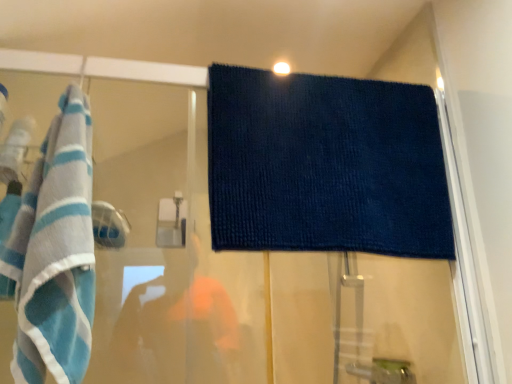
Question: Considering the positions of blue striped towel at left, arranged as the 1th towel when viewed from the front, and dark blue textured towel at upper center, which ranks as the second towel in front-to-back order, in the image, is blue striped towel at left, arranged as the 1th towel when viewed from the front, wider or thinner than dark blue textured towel at upper center, which ranks as the second towel in front-to-back order,?

Choices:
 (A) thin
 (B) wide

Answer: (B)

Question: Considering the positions of blue striped towel at left, which ranks as the 2th towel in back-to-front order, and dark blue textured towel at upper center, which is the 1th towel from right to left, in the image, is blue striped towel at left, which ranks as the 2th towel in back-to-front order, bigger or smaller than dark blue textured towel at upper center, which is the 1th towel from right to left,?

Choices:
 (A) big
 (B) small

Answer: (A)

Question: Is blue striped towel at left, arranged as the 1th towel when viewed from the front, taller or shorter than dark blue textured towel at upper center, the first towel positioned from the back?

Choices:
 (A) short
 (B) tall

Answer: (B)

Question: Considering the positions of dark blue textured towel at upper center, which appears as the 2th towel when viewed from the left, and blue striped towel at left, which is the 2th towel from right to left, in the image, is dark blue textured towel at upper center, which appears as the 2th towel when viewed from the left, bigger or smaller than blue striped towel at left, which is the 2th towel from right to left,?

Choices:
 (A) big
 (B) small

Answer: (B)

Question: Considering their positions, is dark blue textured towel at upper center, which ranks as the second towel in front-to-back order, located in front of or behind blue striped towel at left, which is the 2th towel from right to left?

Choices:
 (A) behind
 (B) front

Answer: (A)

Question: Do you think dark blue textured towel at upper center, the first towel positioned from the back, is within blue striped towel at left, which ranks as the 2th towel in back-to-front order, or outside of it?

Choices:
 (A) inside
 (B) outside

Answer: (B)

Question: Does point (238, 248) appear closer or farther from the camera than point (77, 360)?

Choices:
 (A) closer
 (B) farther

Answer: (B)